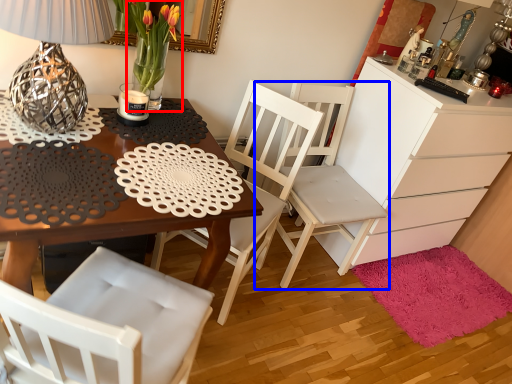
Question: Which object is further to the camera taking this photo, floral arrangement (highlighted by a red box) or chair (highlighted by a blue box)?

Choices:
 (A) floral arrangement
 (B) chair

Answer: (B)